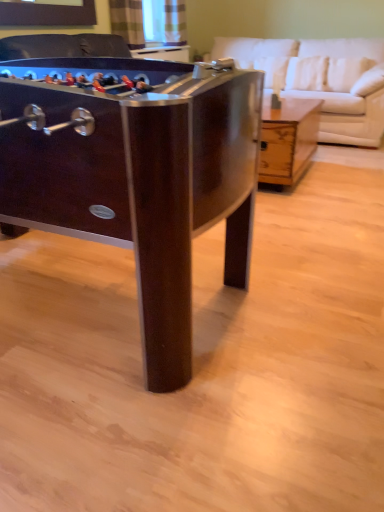
Identify the location of free region under dark wood foosball table at left, positioned as the 2th table in right-to-left order (from a real-world perspective). (66, 305).